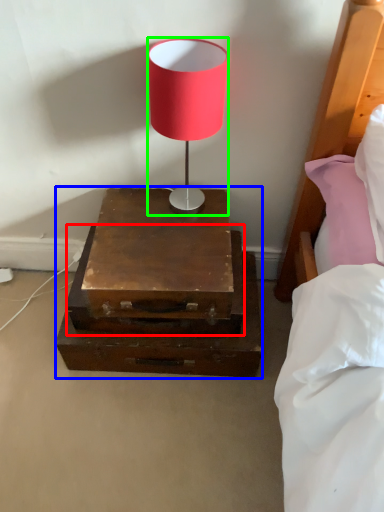
Question: Estimate the real-world distances between objects in this image. Which object is farther from drawer (highlighted by a red box), nightstand (highlighted by a blue box) or lamp (highlighted by a green box)?

Choices:
 (A) nightstand
 (B) lamp

Answer: (B)